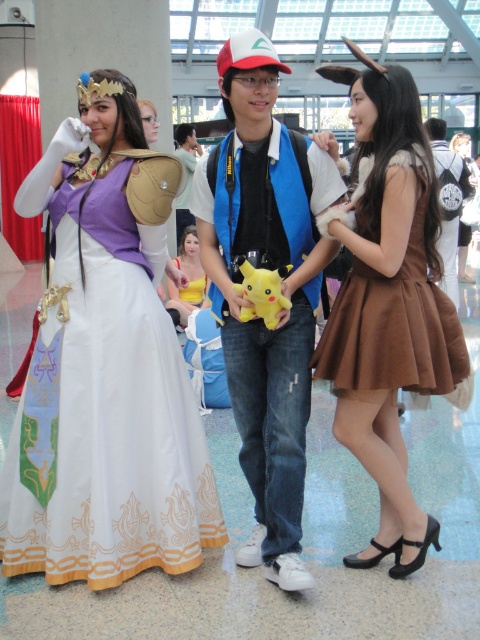
Is brown satin dress at center closer to the viewer compared to brown suede dress at right?

Yes.

Which is more to the right, brown satin dress at center or brown suede dress at right?

From the viewer's perspective, brown satin dress at center appears more on the right side.

Is point (364, 90) positioned before point (393, 352)?

No, (364, 90) is further to viewer.

Locate an element on the screen. brown satin dress at center is located at coordinates (387, 301).

Between white satin dress at center and brown satin dress at center, which one is positioned higher?

Positioned higher is brown satin dress at center.

Can you confirm if white satin dress at center is wider than brown satin dress at center?

Yes, white satin dress at center is wider than brown satin dress at center.

The image size is (480, 640). Identify the location of white satin dress at center. (113, 438).

Who is shorter, white satin dress at center or brown suede dress at right?

With less height is brown suede dress at right.

Does white satin dress at center have a greater width compared to brown suede dress at right?

Indeed, white satin dress at center has a greater width compared to brown suede dress at right.

Between point (124, 312) and point (411, 257), which one is positioned behind?

Positioned behind is point (124, 312).

The width and height of the screenshot is (480, 640). In order to click on white satin dress at center in this screenshot , I will do `click(113, 438)`.